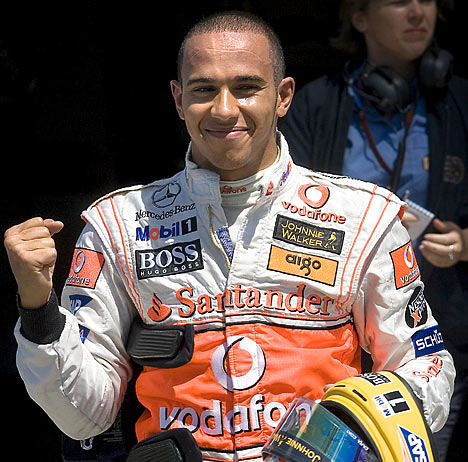
Find the location of a particular element. This screenshot has width=468, height=462. note pad is located at coordinates (421, 214).